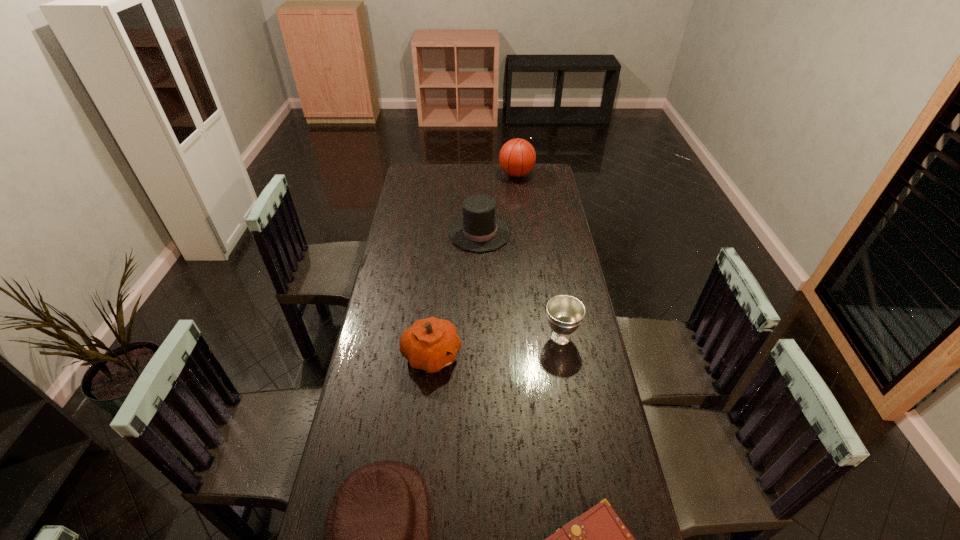
At what (x,y) coordinates should I click in order to perform the action: click on free spot between the chalice and the pumpkin. Please return your answer as a coordinate pair (x, y). The image size is (960, 540). Looking at the image, I should click on (496, 346).

Where is `free space between the basketball and the chalice`? The width and height of the screenshot is (960, 540). free space between the basketball and the chalice is located at coordinates (539, 256).

Identify which object is the closest to the tallest object. Please provide its 2D coordinates. Your answer should be formatted as a tuple, i.e. [(x, y)], where the tuple contains the x and y coordinates of a point satisfying the conditions above.

[(479, 230)]

Image resolution: width=960 pixels, height=540 pixels. I want to click on object that is the second nearest to the farthest object, so click(x=565, y=313).

Image resolution: width=960 pixels, height=540 pixels. Identify the location of free space that satisfies the following two spatial constraints: 1. on the front side of the farthest object; 2. on the front of the farther hat with the decoration. (523, 234).

Image resolution: width=960 pixels, height=540 pixels. Identify the location of vacant region that satisfies the following two spatial constraints: 1. on the front side of the farthest object; 2. on the right side of the chalice. (536, 337).